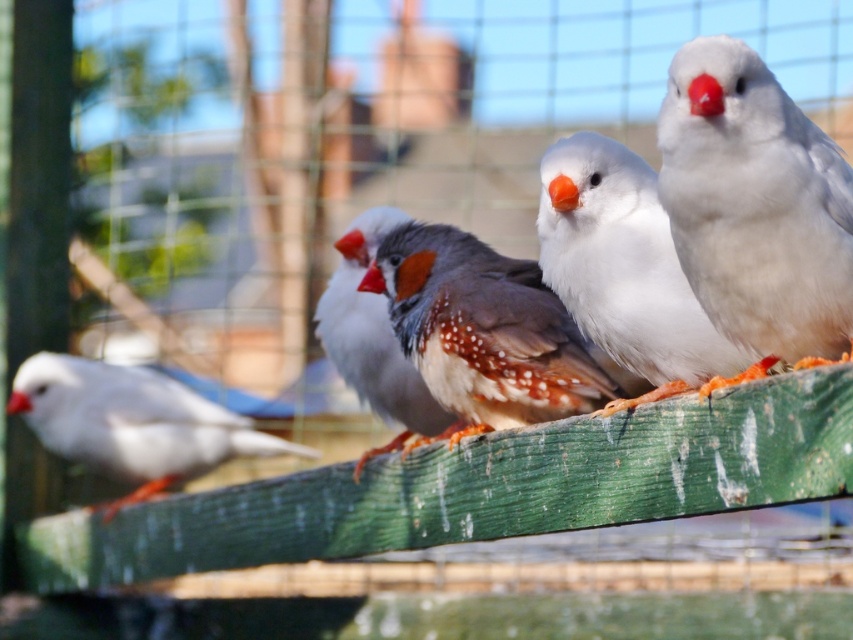
Which is in front, point (445, 272) or point (381, 224)?

Point (445, 272) is in front.

Is speckled brown bird at center bigger than speckled feathered bird at center?

Indeed, speckled brown bird at center has a larger size compared to speckled feathered bird at center.

What do you see at coordinates (482, 332) in the screenshot? Image resolution: width=853 pixels, height=640 pixels. I see `speckled brown bird at center` at bounding box center [482, 332].

Identify the location of speckled brown bird at center. (482, 332).

Can you confirm if white matte bird at left is positioned below speckled feathered bird at center?

Indeed, white matte bird at left is positioned under speckled feathered bird at center.

Who is lower down, white matte bird at left or speckled feathered bird at center?

Positioned lower is white matte bird at left.

What do you see at coordinates (132, 422) in the screenshot? This screenshot has height=640, width=853. I see `white matte bird at left` at bounding box center [132, 422].

At what (x,y) coordinates should I click in order to perform the action: click on white matte bird at left. Please return your answer as a coordinate pair (x, y). This screenshot has width=853, height=640. Looking at the image, I should click on (132, 422).

Based on the photo, who is positioned more to the right, speckled brown bird at center or white matte bird at left?

Positioned to the right is speckled brown bird at center.

Who is taller, speckled brown bird at center or white matte bird at left?

With more height is speckled brown bird at center.

Which is in front, point (505, 301) or point (223, 413)?

Point (505, 301) is more forward.

This screenshot has height=640, width=853. I want to click on speckled brown bird at center, so click(482, 332).